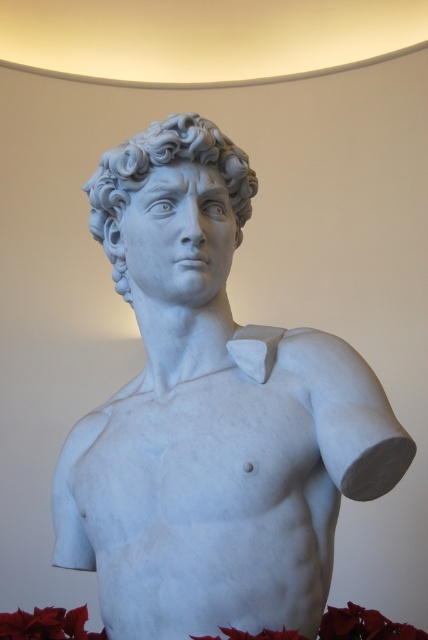
Between white marble bust at center and white marble head at center, which one is positioned higher?

white marble head at center is above.

Is point (139, 385) more distant than point (205, 131)?

That is True.

Between point (183, 136) and point (246, 157), which one is positioned in front?

Point (183, 136)

Locate an element on the screen. The width and height of the screenshot is (428, 640). white marble bust at center is located at coordinates (211, 417).